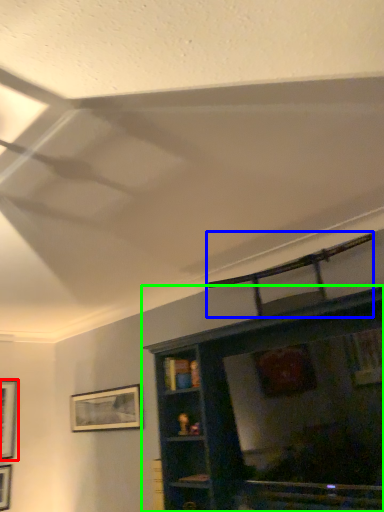
Question: Estimate the real-world distances between objects in this image. Which object is closer to picture frame (highlighted by a red box), swivel chair (highlighted by a blue box) or shelf (highlighted by a green box)?

Choices:
 (A) swivel chair
 (B) shelf

Answer: (B)